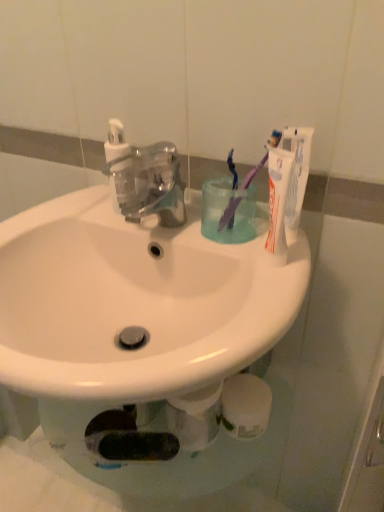
At what (x,y) coordinates should I click in order to perform the action: click on vacant area that is in front of translucent plastic cup at center. Please return your answer as a coordinate pair (x, y). Looking at the image, I should click on (249, 284).